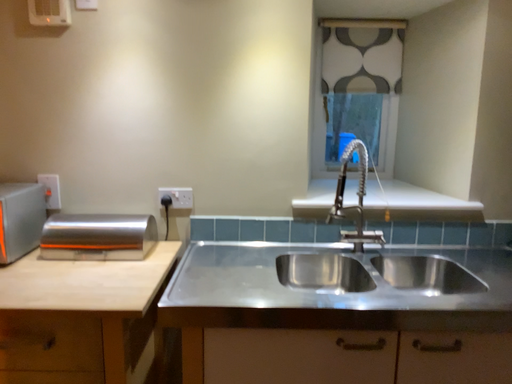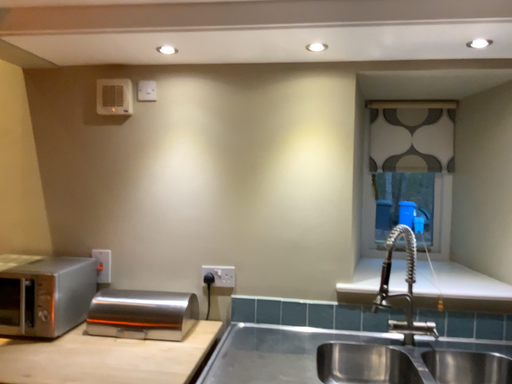
Question: Which way did the camera rotate in the video?

Choices:
 (A) rotated right
 (B) rotated left

Answer: (B)